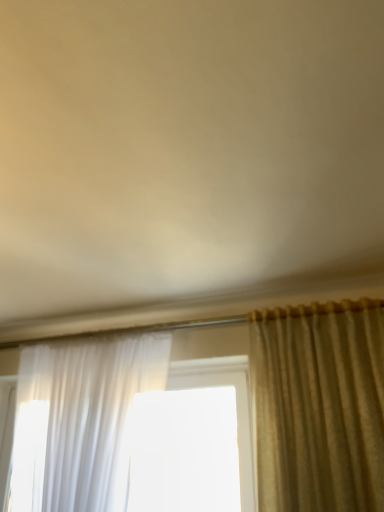
What is the approximate width of sheer white curtain at left, the second curtain from the right?

10.77 inches.

The height and width of the screenshot is (512, 384). What are the coordinates of `sheer white curtain at left, acting as the 1th curtain starting from the left` in the screenshot? It's located at (81, 420).

The width and height of the screenshot is (384, 512). Describe the element at coordinates (81, 420) in the screenshot. I see `sheer white curtain at left, the second curtain from the right` at that location.

Image resolution: width=384 pixels, height=512 pixels. Describe the element at coordinates (319, 406) in the screenshot. I see `silky beige curtain at right, arranged as the 1th curtain when viewed from the right` at that location.

Measure the distance between silky beige curtain at right, placed as the 2th curtain when sorted from left to right, and camera.

The distance of silky beige curtain at right, placed as the 2th curtain when sorted from left to right, from camera is 1.68 meters.

Identify the location of silky beige curtain at right, arranged as the 1th curtain when viewed from the right. This screenshot has height=512, width=384. (319, 406).

I want to click on sheer white curtain at left, acting as the 1th curtain starting from the left, so click(81, 420).

Is silky beige curtain at right, placed as the 2th curtain when sorted from left to right, to the right of sheer white curtain at left, the second curtain from the right, from the viewer's perspective?

Yes.

Consider the image. Between silky beige curtain at right, arranged as the 1th curtain when viewed from the right, and sheer white curtain at left, the second curtain from the right, which one is positioned behind?

Positioned behind is sheer white curtain at left, the second curtain from the right.

Is point (370, 469) in front of point (67, 386)?

That is True.

From the image's perspective, would you say silky beige curtain at right, placed as the 2th curtain when sorted from left to right, is shown under sheer white curtain at left, acting as the 1th curtain starting from the left?

Actually, silky beige curtain at right, placed as the 2th curtain when sorted from left to right, appears above sheer white curtain at left, acting as the 1th curtain starting from the left, in the image.

From a real-world perspective, is silky beige curtain at right, placed as the 2th curtain when sorted from left to right, under sheer white curtain at left, the second curtain from the right?

No, from a real-world perspective, silky beige curtain at right, placed as the 2th curtain when sorted from left to right, is not under sheer white curtain at left, the second curtain from the right.

In the scene shown: Does silky beige curtain at right, arranged as the 1th curtain when viewed from the right, have a greater width compared to sheer white curtain at left, acting as the 1th curtain starting from the left?

Incorrect, the width of silky beige curtain at right, arranged as the 1th curtain when viewed from the right, does not surpass that of sheer white curtain at left, acting as the 1th curtain starting from the left.

In terms of height, does silky beige curtain at right, arranged as the 1th curtain when viewed from the right, look taller or shorter compared to sheer white curtain at left, acting as the 1th curtain starting from the left?

silky beige curtain at right, arranged as the 1th curtain when viewed from the right, is shorter than sheer white curtain at left, acting as the 1th curtain starting from the left.

Is silky beige curtain at right, arranged as the 1th curtain when viewed from the right, smaller than sheer white curtain at left, acting as the 1th curtain starting from the left?

Yes.

Can sheer white curtain at left, the second curtain from the right, be found inside silky beige curtain at right, arranged as the 1th curtain when viewed from the right?

Definitely not — sheer white curtain at left, the second curtain from the right, is not inside silky beige curtain at right, arranged as the 1th curtain when viewed from the right.

Is silky beige curtain at right, arranged as the 1th curtain when viewed from the right, far away from sheer white curtain at left, the second curtain from the right?

No, silky beige curtain at right, arranged as the 1th curtain when viewed from the right, is not far away from sheer white curtain at left, the second curtain from the right.

Does silky beige curtain at right, placed as the 2th curtain when sorted from left to right, turn towards sheer white curtain at left, acting as the 1th curtain starting from the left?

No, silky beige curtain at right, placed as the 2th curtain when sorted from left to right, is not turned towards sheer white curtain at left, acting as the 1th curtain starting from the left.

Find the location of `curtain below the silky beige curtain at right, arranged as the 1th curtain when viewed from the right (from the image's perspective)`. curtain below the silky beige curtain at right, arranged as the 1th curtain when viewed from the right (from the image's perspective) is located at coordinates (81, 420).

Considering the relative positions of sheer white curtain at left, acting as the 1th curtain starting from the left, and silky beige curtain at right, placed as the 2th curtain when sorted from left to right, in the image provided, is sheer white curtain at left, acting as the 1th curtain starting from the left, to the left or to the right of silky beige curtain at right, placed as the 2th curtain when sorted from left to right,?

In the image, sheer white curtain at left, acting as the 1th curtain starting from the left, appears on the left side of silky beige curtain at right, placed as the 2th curtain when sorted from left to right.

Considering their positions, is sheer white curtain at left, acting as the 1th curtain starting from the left, located in front of or behind silky beige curtain at right, arranged as the 1th curtain when viewed from the right?

sheer white curtain at left, acting as the 1th curtain starting from the left, is positioned farther from the viewer than silky beige curtain at right, arranged as the 1th curtain when viewed from the right.

Between point (116, 345) and point (344, 444), which one is positioned in front?

Point (344, 444)

From the image's perspective, is sheer white curtain at left, acting as the 1th curtain starting from the left, on silky beige curtain at right, arranged as the 1th curtain when viewed from the right?

Actually, sheer white curtain at left, acting as the 1th curtain starting from the left, appears below silky beige curtain at right, arranged as the 1th curtain when viewed from the right, in the image.

From a real-world perspective, which object stands above the other?

From a 3D spatial view, silky beige curtain at right, placed as the 2th curtain when sorted from left to right, is above.

Does sheer white curtain at left, the second curtain from the right, have a greater width compared to silky beige curtain at right, arranged as the 1th curtain when viewed from the right?

Correct, the width of sheer white curtain at left, the second curtain from the right, exceeds that of silky beige curtain at right, arranged as the 1th curtain when viewed from the right.

Does sheer white curtain at left, the second curtain from the right, have a lesser height compared to silky beige curtain at right, arranged as the 1th curtain when viewed from the right?

In fact, sheer white curtain at left, the second curtain from the right, may be taller than silky beige curtain at right, arranged as the 1th curtain when viewed from the right.

Considering the relative sizes of sheer white curtain at left, the second curtain from the right, and silky beige curtain at right, arranged as the 1th curtain when viewed from the right, in the image provided, is sheer white curtain at left, the second curtain from the right, smaller than silky beige curtain at right, arranged as the 1th curtain when viewed from the right,?

No, sheer white curtain at left, the second curtain from the right, is not smaller than silky beige curtain at right, arranged as the 1th curtain when viewed from the right.

Is sheer white curtain at left, the second curtain from the right, positioned beyond the bounds of silky beige curtain at right, arranged as the 1th curtain when viewed from the right?

Yes, sheer white curtain at left, the second curtain from the right, is outside of silky beige curtain at right, arranged as the 1th curtain when viewed from the right.

In the scene shown: Is sheer white curtain at left, the second curtain from the right, not near silky beige curtain at right, placed as the 2th curtain when sorted from left to right?

No, there isn't a large distance between sheer white curtain at left, the second curtain from the right, and silky beige curtain at right, placed as the 2th curtain when sorted from left to right.

Looking at this image, does sheer white curtain at left, the second curtain from the right, turn towards silky beige curtain at right, arranged as the 1th curtain when viewed from the right?

No, sheer white curtain at left, the second curtain from the right, is not oriented towards silky beige curtain at right, arranged as the 1th curtain when viewed from the right.

What's the angular difference between sheer white curtain at left, acting as the 1th curtain starting from the left, and silky beige curtain at right, arranged as the 1th curtain when viewed from the right,'s facing directions?

3.71 degrees.

You are a GUI agent. You are given a task and a screenshot of the screen. Output one action in this format:
    pyautogui.click(x=<x>, y=<y>)
    Task: Click on the curtain on the left of silky beige curtain at right, placed as the 2th curtain when sorted from left to right
    
    Given the screenshot: What is the action you would take?
    pyautogui.click(x=81, y=420)

Image resolution: width=384 pixels, height=512 pixels. In order to click on curtain above the sheer white curtain at left, the second curtain from the right (from the image's perspective) in this screenshot , I will do `click(319, 406)`.

I want to click on curtain lying behind the silky beige curtain at right, placed as the 2th curtain when sorted from left to right, so [x=81, y=420].